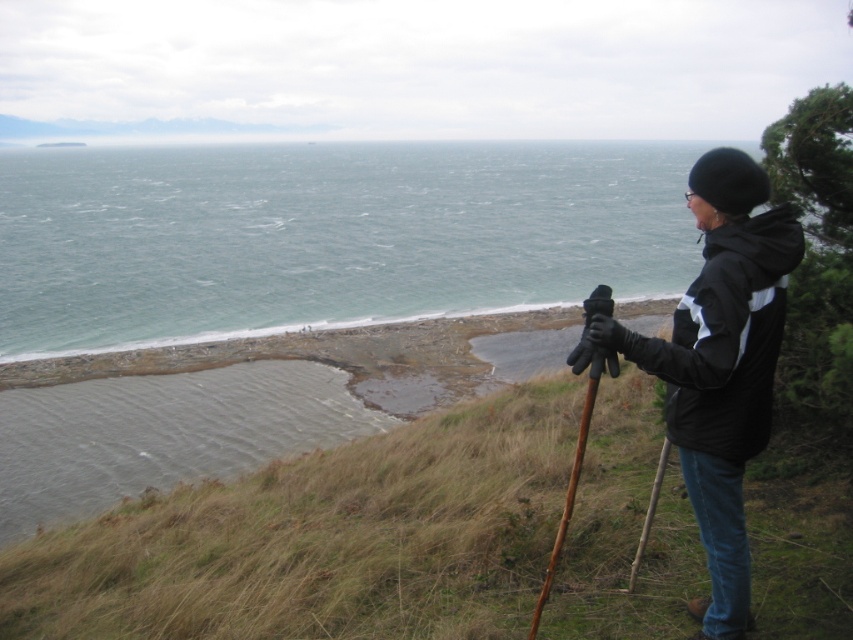
Is green grassy at lower left thinner than black matte jacket at center right?

In fact, green grassy at lower left might be wider than black matte jacket at center right.

Is point (184, 573) closer to camera compared to point (683, 355)?

No.

Is point (822, 484) closer to camera compared to point (727, 381)?

No, (822, 484) is further to viewer.

Identify the location of green grassy at lower left. This screenshot has height=640, width=853. (323, 538).

Does point (654, 449) come behind point (196, 308)?

That is False.

Image resolution: width=853 pixels, height=640 pixels. Describe the element at coordinates (323, 538) in the screenshot. I see `green grassy at lower left` at that location.

Find the location of a particular element. green grassy at lower left is located at coordinates (323, 538).

Between blue-green water at center and black matte jacket at center right, which one appears on the left side from the viewer's perspective?

blue-green water at center

Image resolution: width=853 pixels, height=640 pixels. In order to click on blue-green water at center in this screenshot , I will do `click(325, 236)`.

Image resolution: width=853 pixels, height=640 pixels. I want to click on blue-green water at center, so click(x=325, y=236).